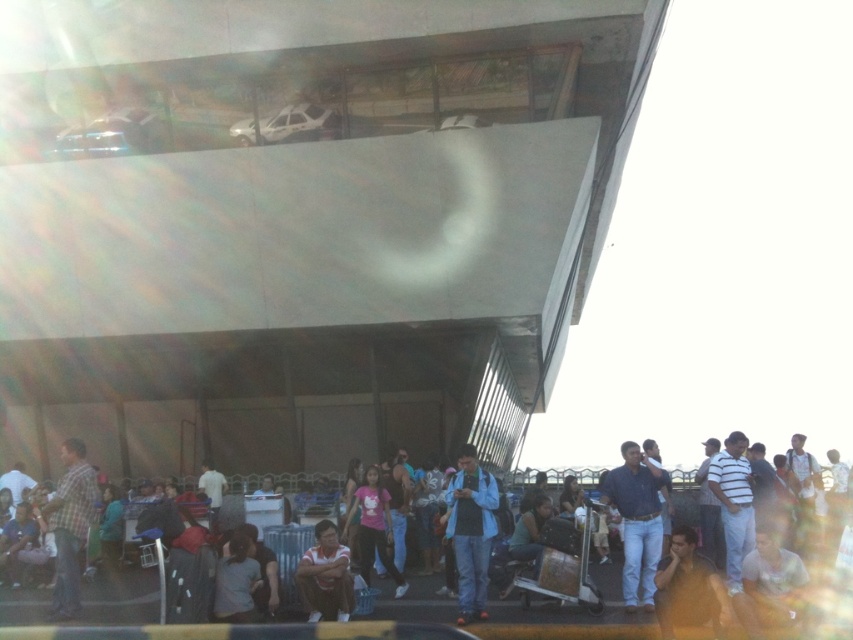
Based on the photo, who is more distant from viewer, (688, 529) or (308, 552)?

Positioned behind is point (308, 552).

Describe the element at coordinates (688, 588) in the screenshot. I see `matte yellow shirt at lower right` at that location.

The width and height of the screenshot is (853, 640). What are the coordinates of `matte yellow shirt at lower right` in the screenshot? It's located at (688, 588).

Does plaid fabric shirt at lower left appear under matte yellow shirt at lower right?

No, plaid fabric shirt at lower left is not below matte yellow shirt at lower right.

Between plaid fabric shirt at lower left and matte yellow shirt at lower right, which one has more height?

plaid fabric shirt at lower left

Locate an element on the screen. plaid fabric shirt at lower left is located at coordinates [x=70, y=525].

Between point (86, 509) and point (326, 538), which one is positioned behind?

Point (86, 509)

Looking at this image, can you confirm if plaid fabric shirt at lower left is shorter than white shirt at center?

No.

Locate an element on the screen. The width and height of the screenshot is (853, 640). plaid fabric shirt at lower left is located at coordinates (70, 525).

Where is `plaid fabric shirt at lower left`? plaid fabric shirt at lower left is located at coordinates [x=70, y=525].